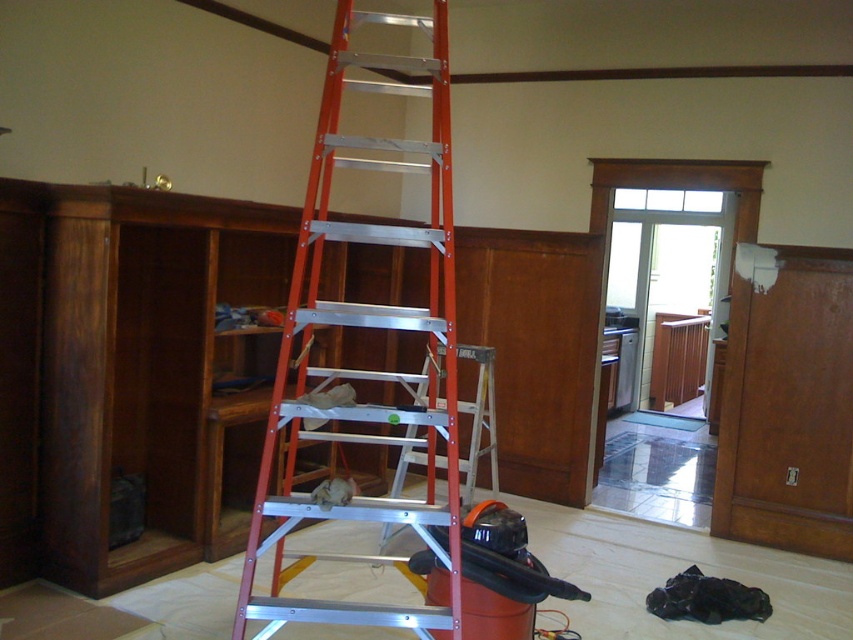
Question: Which of the following is the farthest from the observer?

Choices:
 (A) (314, 164)
 (B) (401, 451)

Answer: (B)

Question: Which object is farther from the camera taking this photo?

Choices:
 (A) orange metallic ladder at center
 (B) red aluminum ladder at center

Answer: (B)

Question: Can you confirm if orange metallic ladder at center is bigger than red aluminum ladder at center?

Choices:
 (A) yes
 (B) no

Answer: (A)

Question: Which object is farther from the camera taking this photo?

Choices:
 (A) red aluminum ladder at center
 (B) orange metallic ladder at center

Answer: (A)

Question: Observing the image, what is the correct spatial positioning of orange metallic ladder at center in reference to red aluminum ladder at center?

Choices:
 (A) left
 (B) right

Answer: (A)

Question: Is orange metallic ladder at center to the left of red aluminum ladder at center from the viewer's perspective?

Choices:
 (A) yes
 (B) no

Answer: (A)